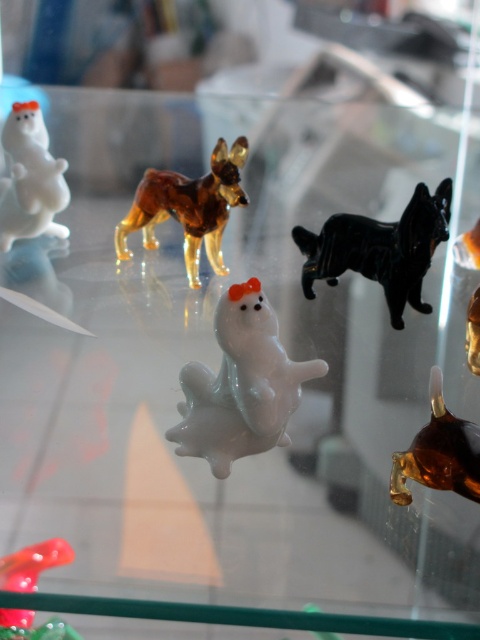
You are a collector who wants to place a new small glass frog figurine between the white glossy bear at upper left and the translucent red figurine at lower left. Based on their sizes, which side should you place the frog closer to?

The white glossy bear at upper left is much taller than the translucent red figurine at lower left, so the glass frog should be placed closer to the translucent red figurine at lower left since it is shorter and the frog would fit better in that space.

You are a collector who wants to display both the amber glass dog at upper center and the amber glass dog at right on a shelf. Which of the two should you place closer to the front of the shelf to ensure both are visible?

The amber glass dog at upper center is larger in size than the amber glass dog at right, so placing the smaller amber glass dog at right closer to the front of the shelf will ensure both are visible.